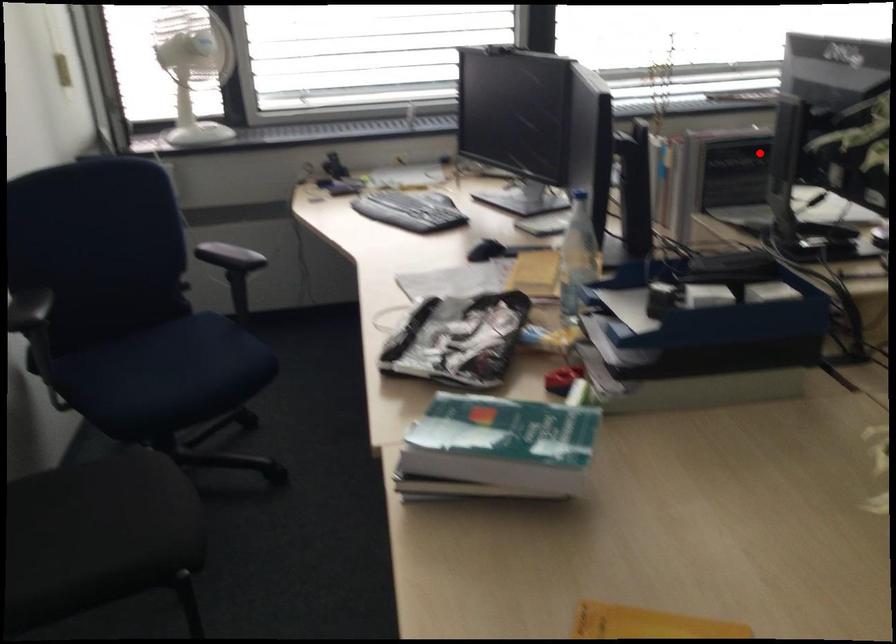
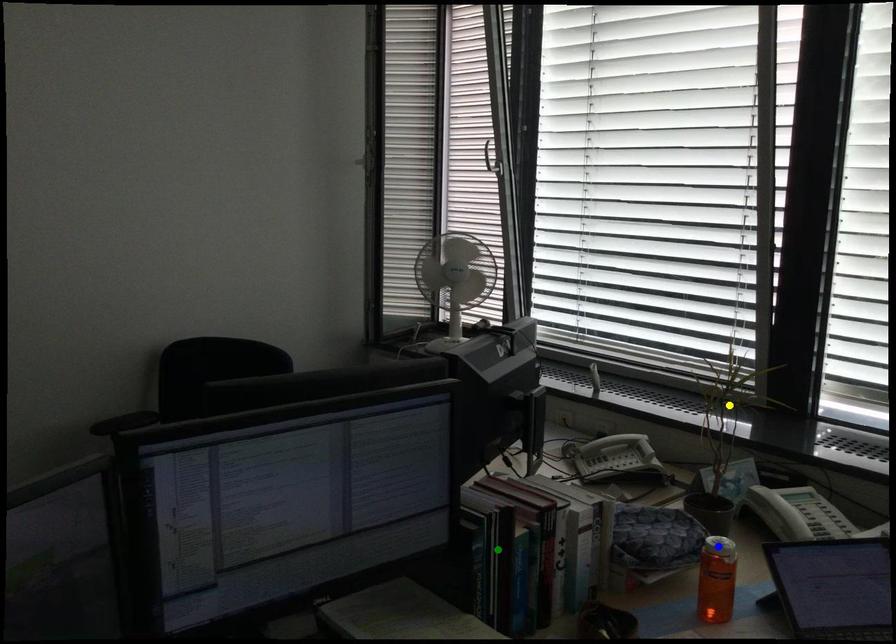
Question: I am providing you with two images of the same scene from different viewpoints. A red point is marked on the first image. You are given multiple points on the second image. In image 2, which mark is for the same physical point as the one in image 1?

Choices:
 (A) yellow point
 (B) green point
 (C) blue point

Answer: (B)